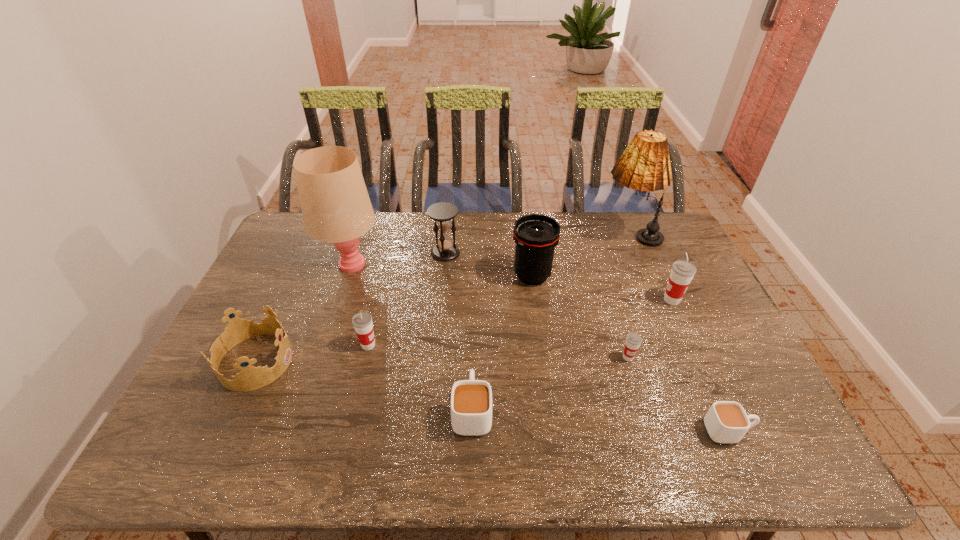
You are a GUI agent. You are given a task and a screenshot of the screen. Output one action in this format:
    pyautogui.click(x=<x>, y=<y>)
    Task: Click on the right lampshade
    
    Given the screenshot: What is the action you would take?
    pyautogui.click(x=645, y=165)

This screenshot has width=960, height=540. What are the coordinates of `the left lampshade` in the screenshot? It's located at (336, 208).

This screenshot has width=960, height=540. I want to click on the sixth object from left to right, so click(x=536, y=236).

This screenshot has width=960, height=540. I want to click on the sixth nearest object, so click(x=682, y=272).

At what (x,y) coordinates should I click in order to perform the action: click on the biggest red cup. Please return your answer as a coordinate pair (x, y). Image resolution: width=960 pixels, height=540 pixels. Looking at the image, I should click on (682, 272).

This screenshot has height=540, width=960. In order to click on hourglass in this screenshot , I will do `click(443, 213)`.

This screenshot has height=540, width=960. Identify the location of black hourglass. (443, 213).

The image size is (960, 540). I want to click on the second smallest red cup, so click(x=362, y=322).

At what (x,y) coordinates should I click in order to perform the action: click on the leftmost cup. Please return your answer as a coordinate pair (x, y). Image resolution: width=960 pixels, height=540 pixels. Looking at the image, I should click on (362, 322).

You are a GUI agent. You are given a task and a screenshot of the screen. Output one action in this format:
    pyautogui.click(x=<x>, y=<y>)
    Task: Click on the tiara
    
    Given the screenshot: What is the action you would take?
    pyautogui.click(x=250, y=378)